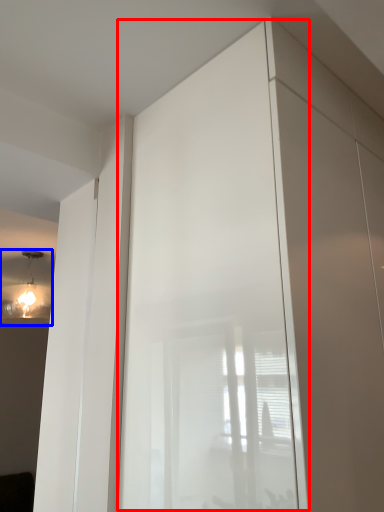
Question: Which object appears farthest to the camera in this image, screen door (highlighted by a red box) or light fixture (highlighted by a blue box)?

Choices:
 (A) screen door
 (B) light fixture

Answer: (B)